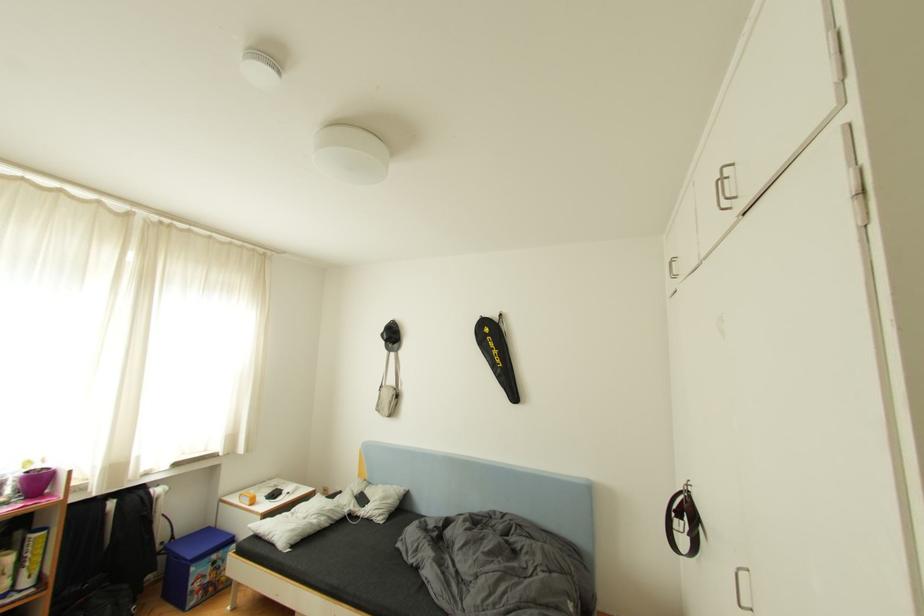
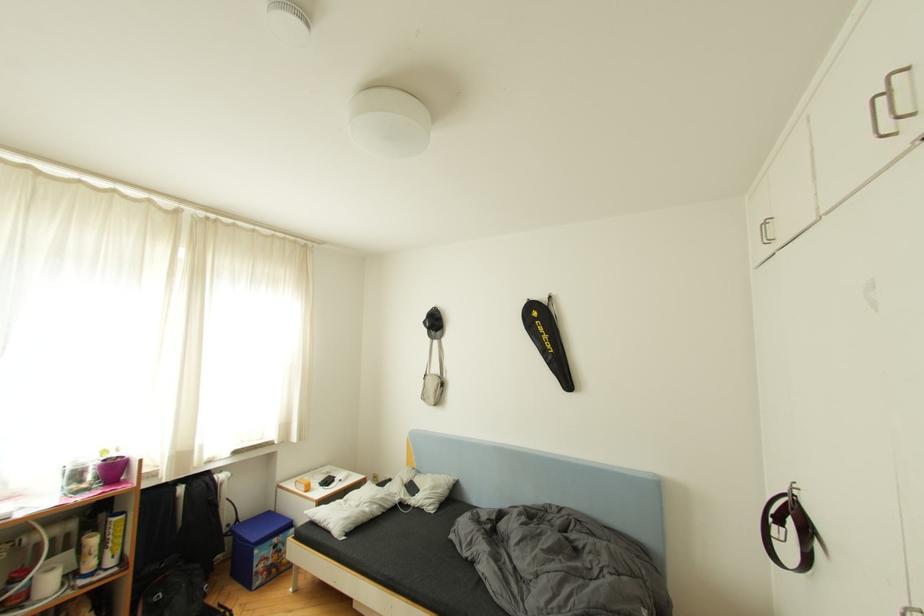
The images are taken continuously from a first-person perspective. In which direction are you moving?

The cameraman moved toward left, forward.